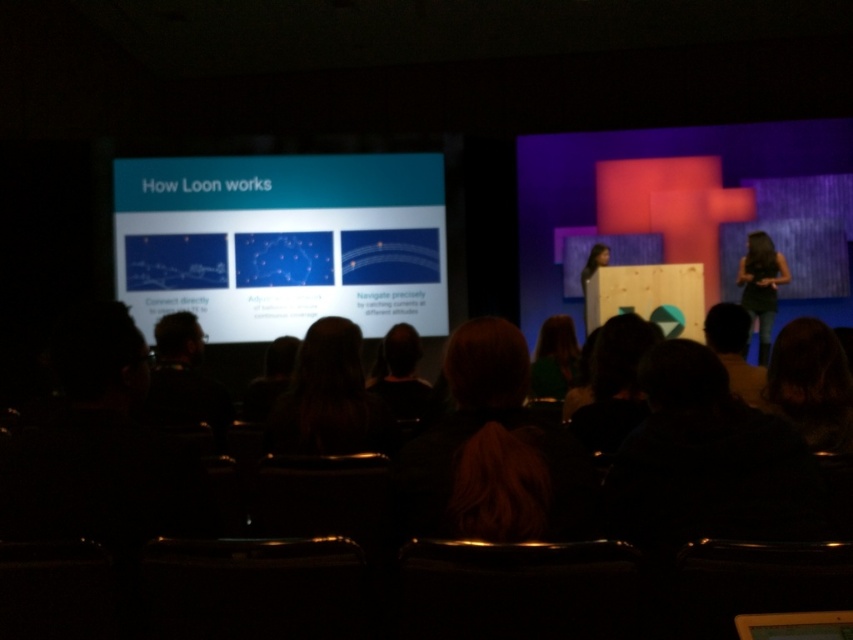
Question: Is white glossy projector screen at upper left to the left of dark green fabric dress at right from the viewer's perspective?

Choices:
 (A) no
 (B) yes

Answer: (B)

Question: Among these objects, which one is farthest from the camera?

Choices:
 (A) white glossy projector screen at upper left
 (B) dark brown hair at center
 (C) matte black dress at center
 (D) dark green fabric dress at right

Answer: (C)

Question: Is dark green fabric dress at right positioned at the back of matte black dress at center?

Choices:
 (A) no
 (B) yes

Answer: (A)

Question: Does dark brown hair at center lie behind matte black dress at center?

Choices:
 (A) yes
 (B) no

Answer: (B)

Question: Estimate the real-world distances between objects in this image. Which object is closer to the dark brown hair at center?

Choices:
 (A) white glossy projector screen at upper left
 (B) dark green fabric dress at right

Answer: (B)

Question: Which of the following is the farthest from the observer?

Choices:
 (A) (393, 172)
 (B) (589, 253)

Answer: (B)